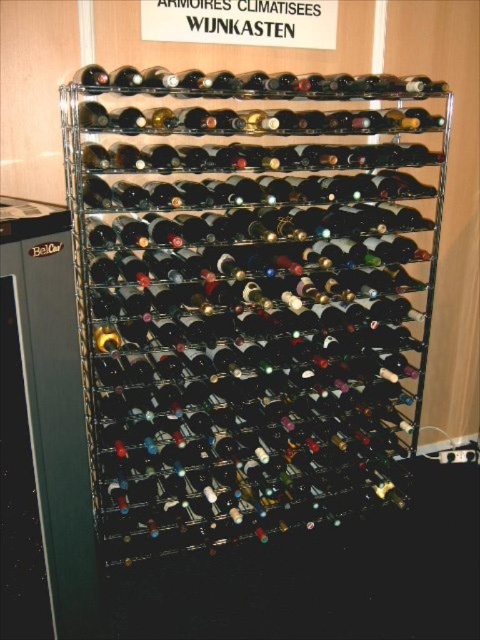
Can you confirm if black metal wine rack at center is shorter than matte black wine bottle at center?

Incorrect, black metal wine rack at center's height does not fall short of matte black wine bottle at center's.

Who is positioned more to the right, black metal wine rack at center or matte black wine bottle at center?

black metal wine rack at center

Describe the element at coordinates (250, 296) in the screenshot. This screenshot has height=640, width=480. I see `black metal wine rack at center` at that location.

Locate an element on the screen. black metal wine rack at center is located at coordinates (250, 296).